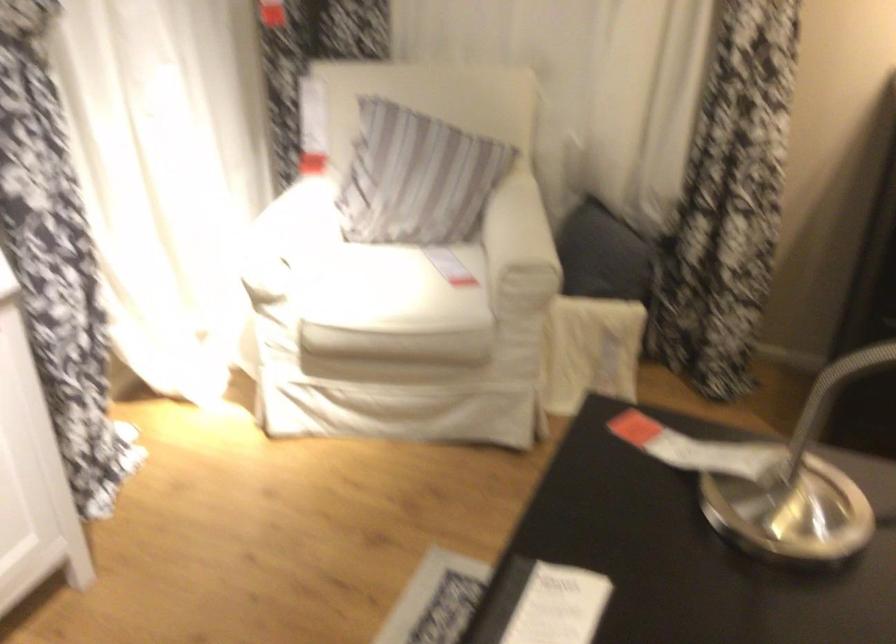
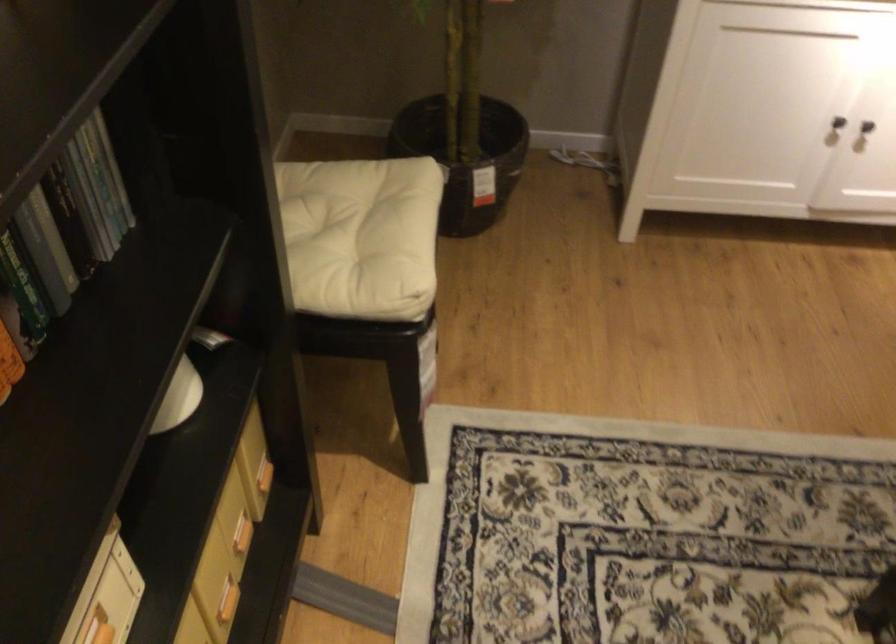
The first image is from the beginning of the video and the second image is from the end. How did the camera likely rotate when shooting the video?

The camera's rotation is toward left-down.